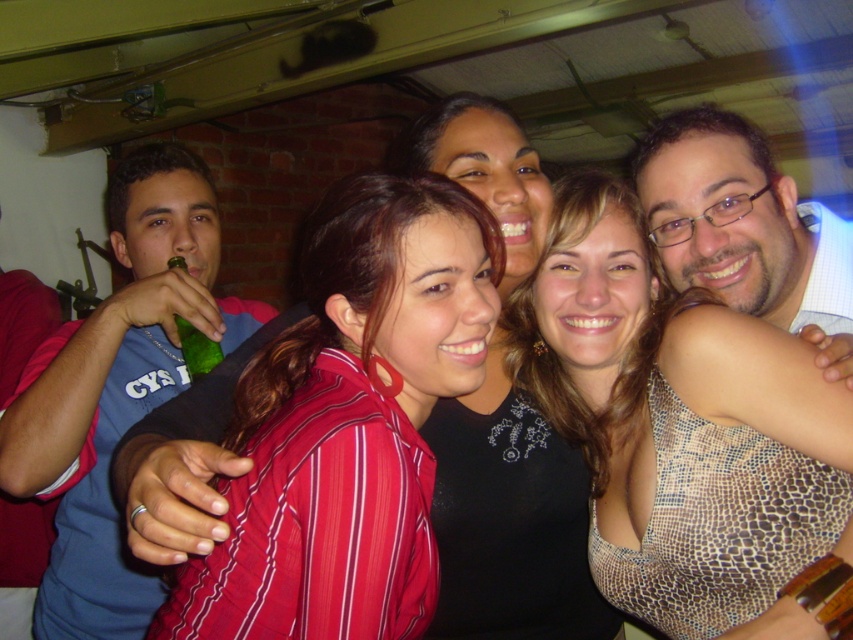
You are standing at the origin point of the image coordinate system. You want to move towards the striped fabric shirt at center. In which direction should you move first?

Since the striped fabric shirt at center is located at point (349,422), you should move to the right first because the x coordinate is greater than 0.5, indicating it is to the right of the center.

You are at a party and need to hand a small item to someone. You see the blue fabric shirt at left and the green glass bottle at upper left. Which object is taller so you can place the item on top?

The blue fabric shirt at left is taller than the green glass bottle at upper left, so you can place the item on top of the blue fabric shirt at left.

You are organizing a clothing donation drive and need to determine which shirt takes up more space when folded. Based on the image, which of the two shirts, the striped fabric shirt at center or the red cotton shirt at left, is wider?

The striped fabric shirt at center is wider than the red cotton shirt at left, so it takes up more space when folded.